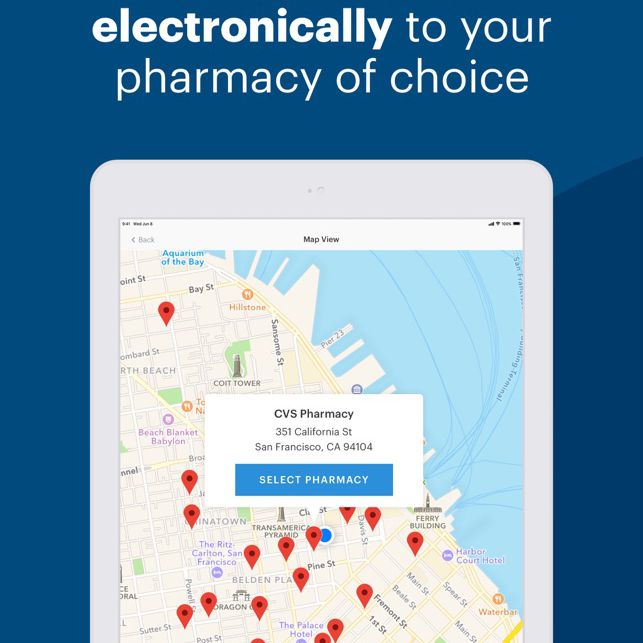
Find the location of a particular element. The image size is (643, 643). time display is located at coordinates (122, 222).